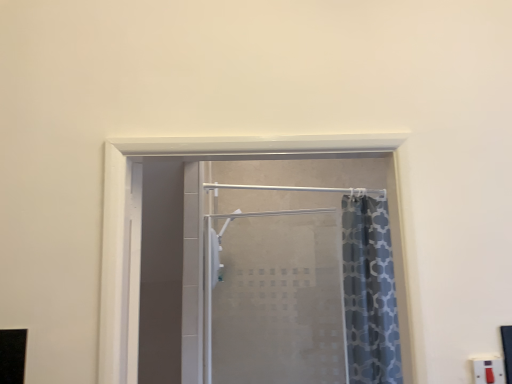
Question: Does white plastic electric outlet at lower right have a larger size compared to frosted glass shower door at center?

Choices:
 (A) no
 (B) yes

Answer: (A)

Question: Can you confirm if white plastic electric outlet at lower right is taller than frosted glass shower door at center?

Choices:
 (A) no
 (B) yes

Answer: (A)

Question: Is white plastic electric outlet at lower right to the left of frosted glass shower door at center from the viewer's perspective?

Choices:
 (A) no
 (B) yes

Answer: (A)

Question: Is the depth of white plastic electric outlet at lower right greater than that of frosted glass shower door at center?

Choices:
 (A) no
 (B) yes

Answer: (A)

Question: Considering the relative sizes of white plastic electric outlet at lower right and frosted glass shower door at center in the image provided, is white plastic electric outlet at lower right wider than frosted glass shower door at center?

Choices:
 (A) no
 (B) yes

Answer: (A)

Question: Is white plastic electric outlet at lower right beside frosted glass shower door at center?

Choices:
 (A) no
 (B) yes

Answer: (A)

Question: Does frosted glass shower door at center have a greater height compared to white plastic electric outlet at lower right?

Choices:
 (A) yes
 (B) no

Answer: (A)

Question: Is frosted glass shower door at center completely or partially outside of white plastic electric outlet at lower right?

Choices:
 (A) no
 (B) yes

Answer: (B)

Question: Does frosted glass shower door at center contain white plastic electric outlet at lower right?

Choices:
 (A) no
 (B) yes

Answer: (A)

Question: Does frosted glass shower door at center have a larger size compared to white plastic electric outlet at lower right?

Choices:
 (A) yes
 (B) no

Answer: (A)

Question: Is frosted glass shower door at center smaller than white plastic electric outlet at lower right?

Choices:
 (A) yes
 (B) no

Answer: (B)

Question: From a real-world perspective, is frosted glass shower door at center on top of white plastic electric outlet at lower right?

Choices:
 (A) yes
 (B) no

Answer: (A)

Question: From the image's perspective, is white plastic electric outlet at lower right located above or below frosted glass shower door at center?

Choices:
 (A) above
 (B) below

Answer: (A)